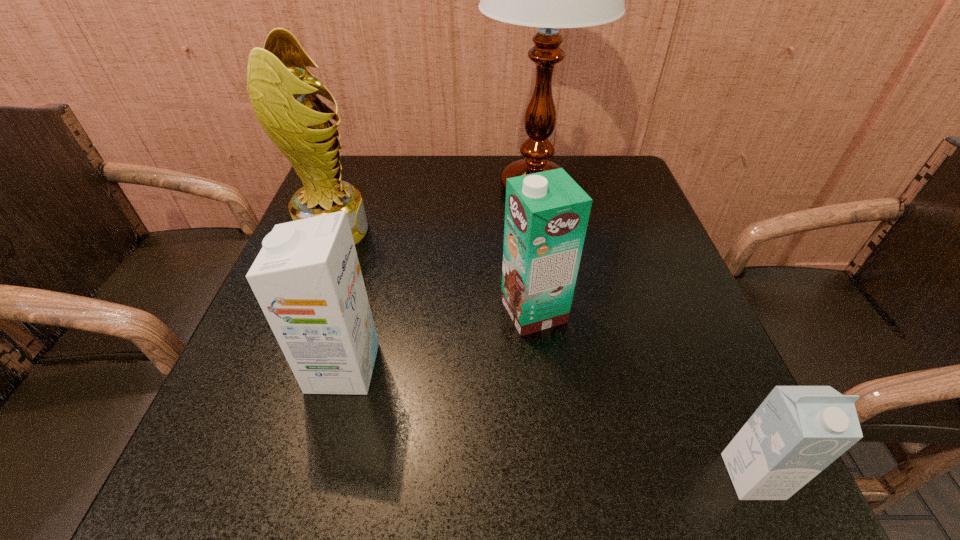
The image size is (960, 540). I want to click on free space at the far edge, so click(x=492, y=167).

You are a GUI agent. You are given a task and a screenshot of the screen. Output one action in this format:
    pyautogui.click(x=<x>, y=<y>)
    Task: Click on the free spot at the right edge of the desktop
    
    Given the screenshot: What is the action you would take?
    pyautogui.click(x=689, y=399)

What are the coordinates of `blank area at the far left corner` in the screenshot? It's located at (346, 155).

Where is `vacant region at the near left corner`? The image size is (960, 540). vacant region at the near left corner is located at coordinates (190, 462).

You are a GUI agent. You are given a task and a screenshot of the screen. Output one action in this format:
    pyautogui.click(x=<x>, y=<y>)
    Task: Click on the vacant space at the far right corner
    Image resolution: width=960 pixels, height=540 pixels.
    Given the screenshot: What is the action you would take?
    pyautogui.click(x=615, y=192)

Where is `free area in between the rightmost carton and the tallest object`? Image resolution: width=960 pixels, height=540 pixels. free area in between the rightmost carton and the tallest object is located at coordinates (643, 332).

Locate an element on the screen. empty space that is in between the third farthest object and the fourth shortest object is located at coordinates (434, 271).

Identify the location of vacant space that is in between the award and the rightmost object. (543, 354).

Where is `vacant point located between the nearest carton and the leftmost carton`? The height and width of the screenshot is (540, 960). vacant point located between the nearest carton and the leftmost carton is located at coordinates (548, 422).

At what (x,y) coordinates should I click in order to perform the action: click on free spot between the second carton from left to right and the second farthest carton. Please return your answer as a coordinate pair (x, y). The height and width of the screenshot is (540, 960). Looking at the image, I should click on (439, 339).